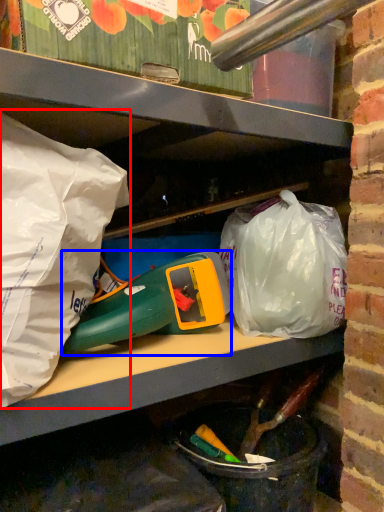
Question: Which of the following is the farthest to the observer, plastic bag (highlighted by a red box) or toy (highlighted by a blue box)?

Choices:
 (A) plastic bag
 (B) toy

Answer: (B)